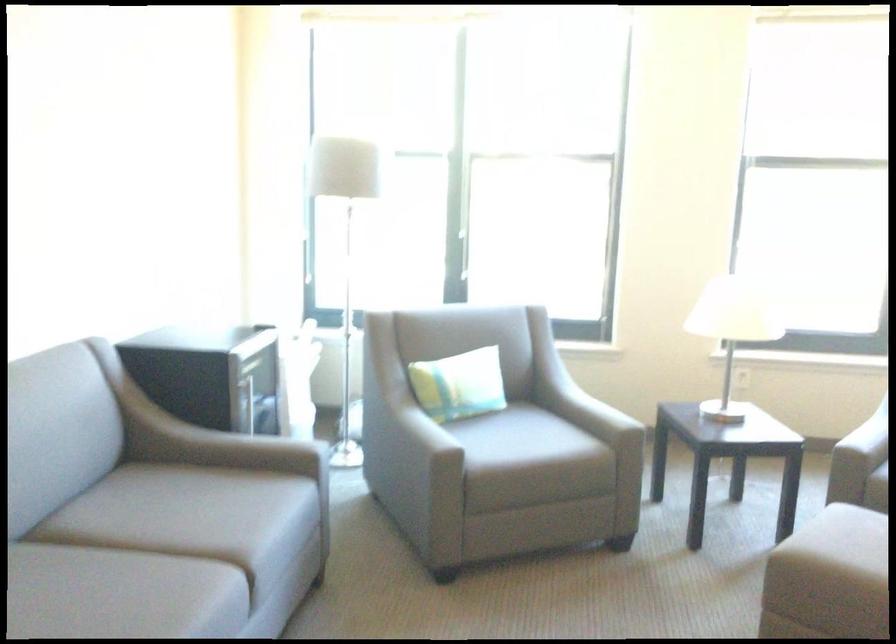
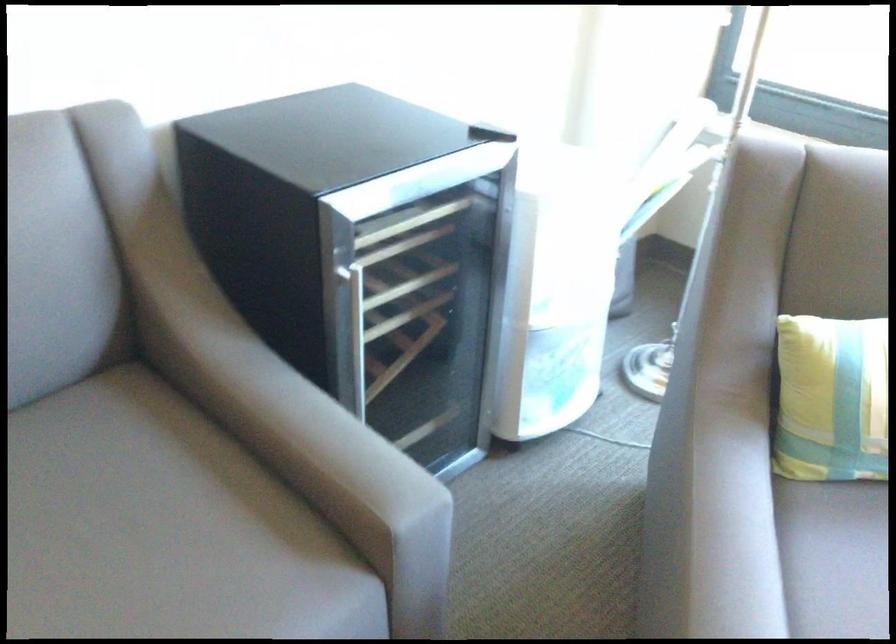
Locate, in the second image, the point that corresponds to pixel 136 538 in the first image.

(83, 529)